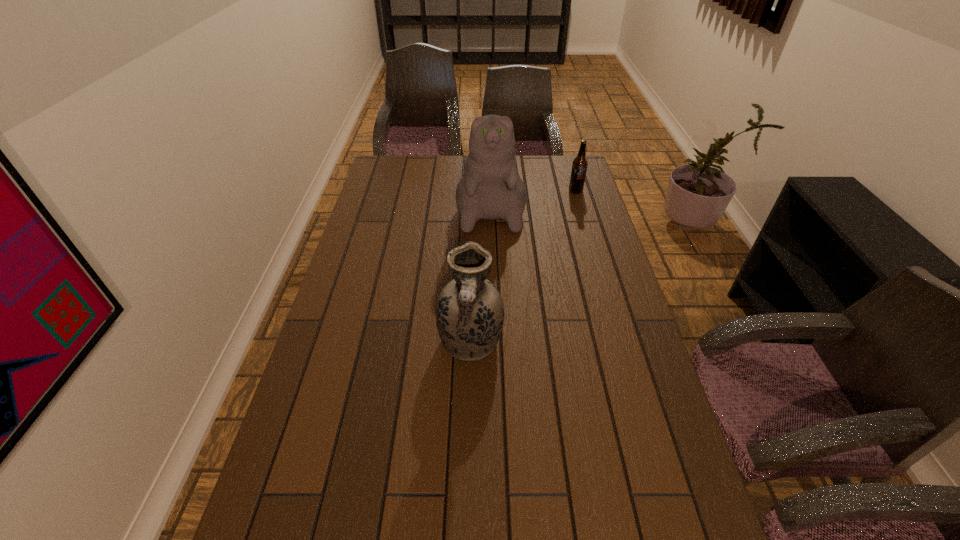
Locate an element on the screen. The image size is (960, 540). vacant space at the left edge of the desktop is located at coordinates (331, 530).

In the image, there is a desktop. Identify the location of vacant space at the right edge. (610, 299).

Where is `vacant space in between the shortest object and the second tallest object`? vacant space in between the shortest object and the second tallest object is located at coordinates (523, 267).

Where is `vacant space in between the shortest object and the tallest object`? vacant space in between the shortest object and the tallest object is located at coordinates (533, 195).

You are a GUI agent. You are given a task and a screenshot of the screen. Output one action in this format:
    pyautogui.click(x=<x>, y=<y>)
    Task: Click on the free space between the cat and the beer bottle
    
    Given the screenshot: What is the action you would take?
    pyautogui.click(x=533, y=195)

Locate an element on the screen. vacant space that is in between the tallest object and the beer bottle is located at coordinates (533, 195).

Where is `empty space that is in between the beer bottle and the nearest object`? Image resolution: width=960 pixels, height=540 pixels. empty space that is in between the beer bottle and the nearest object is located at coordinates (523, 267).

At what (x,y) coordinates should I click in order to perform the action: click on object that is the second closest to the cat. Please return your answer as a coordinate pair (x, y). Looking at the image, I should click on (469, 312).

Identify the location of object that ranks as the second closest to the second shortest object. The height and width of the screenshot is (540, 960). pyautogui.click(x=580, y=163).